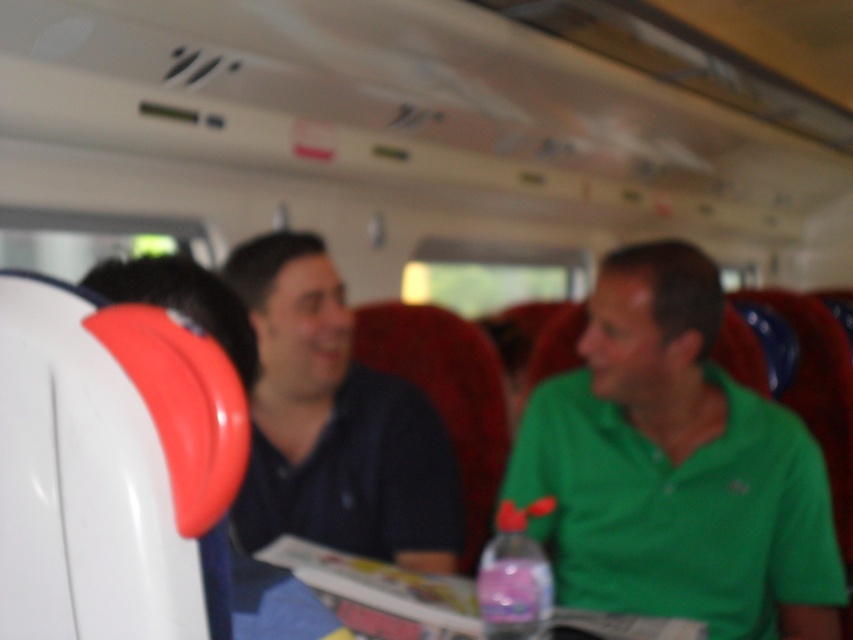
How far apart are green matte shirt at center and dark blue shirt at center?

14.80 inches

Locate an element on the screen. green matte shirt at center is located at coordinates (675, 467).